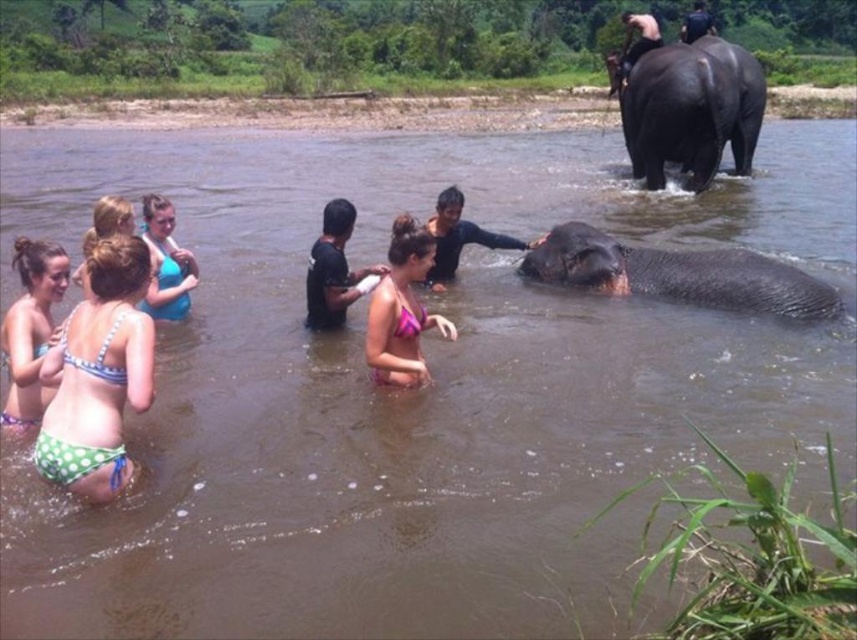
Question: Which point is closer to the camera?

Choices:
 (A) black matte shirt at center
 (B) dark brown skin at center
 (C) black matte shirt at upper center

Answer: (A)

Question: Which point is farther to the camera?

Choices:
 (A) black matte shirt at upper center
 (B) blue bikini at center

Answer: (A)

Question: Does green polka dot bikini at lower left come in front of black matte shirt at center?

Choices:
 (A) no
 (B) yes

Answer: (B)

Question: Is polka dot bikini at left wider than dark brown skin at center?

Choices:
 (A) no
 (B) yes

Answer: (A)

Question: Which point is closer to the camera?

Choices:
 (A) (28, 284)
 (B) (331, 244)
 (C) (142, 195)
 (D) (706, 16)

Answer: (A)

Question: Does polka dot bikini at left have a smaller size compared to dark brown skin at center?

Choices:
 (A) yes
 (B) no

Answer: (A)